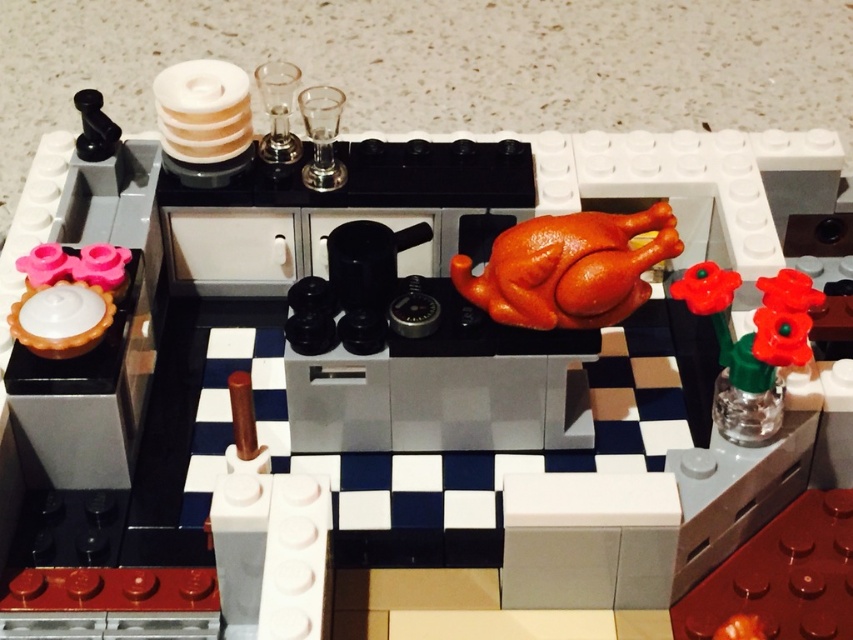
Question: Which point is closer to the camera taking this photo?

Choices:
 (A) (630, 289)
 (B) (722, 284)

Answer: (A)

Question: Does shiny orange turkey at center appear on the right side of translucent green glass vase at right?

Choices:
 (A) no
 (B) yes

Answer: (A)

Question: Is shiny orange turkey at center wider than translucent green glass vase at right?

Choices:
 (A) no
 (B) yes

Answer: (B)

Question: Can you confirm if shiny orange turkey at center is thinner than translucent green glass vase at right?

Choices:
 (A) no
 (B) yes

Answer: (A)